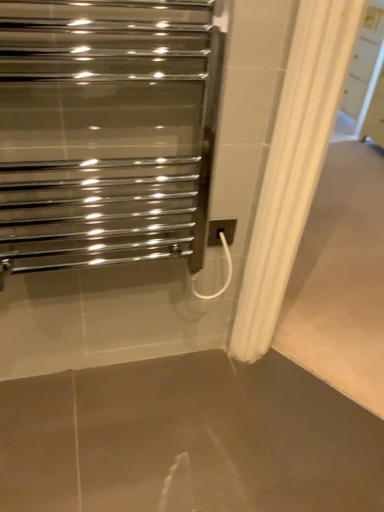
Question: Can you confirm if brown polished concrete at center is bigger than polished chrome towel warmer at upper left?

Choices:
 (A) yes
 (B) no

Answer: (B)

Question: Does brown polished concrete at center have a lesser height compared to polished chrome towel warmer at upper left?

Choices:
 (A) no
 (B) yes

Answer: (B)

Question: Could you tell me if brown polished concrete at center is facing polished chrome towel warmer at upper left?

Choices:
 (A) yes
 (B) no

Answer: (B)

Question: Is brown polished concrete at center next to polished chrome towel warmer at upper left and touching it?

Choices:
 (A) no
 (B) yes

Answer: (A)

Question: From a real-world perspective, is brown polished concrete at center positioned under polished chrome towel warmer at upper left based on gravity?

Choices:
 (A) yes
 (B) no

Answer: (A)

Question: Can you confirm if brown polished concrete at center is positioned to the right of polished chrome towel warmer at upper left?

Choices:
 (A) yes
 (B) no

Answer: (A)

Question: Considering the relative sizes of white plastic electric outlet at center-right and brown polished concrete at center in the image provided, is white plastic electric outlet at center-right thinner than brown polished concrete at center?

Choices:
 (A) no
 (B) yes

Answer: (B)

Question: Does white plastic electric outlet at center-right turn towards brown polished concrete at center?

Choices:
 (A) no
 (B) yes

Answer: (A)

Question: Is brown polished concrete at center at the back of white plastic electric outlet at center-right?

Choices:
 (A) yes
 (B) no

Answer: (B)

Question: Considering the relative sizes of white plastic electric outlet at center-right and brown polished concrete at center in the image provided, is white plastic electric outlet at center-right taller than brown polished concrete at center?

Choices:
 (A) no
 (B) yes

Answer: (B)

Question: Does white plastic electric outlet at center-right have a greater width compared to brown polished concrete at center?

Choices:
 (A) no
 (B) yes

Answer: (A)

Question: Is white plastic electric outlet at center-right positioned far away from brown polished concrete at center?

Choices:
 (A) yes
 (B) no

Answer: (B)

Question: Is polished chrome towel warmer at upper left shorter than white plastic electric outlet at center-right?

Choices:
 (A) no
 (B) yes

Answer: (A)